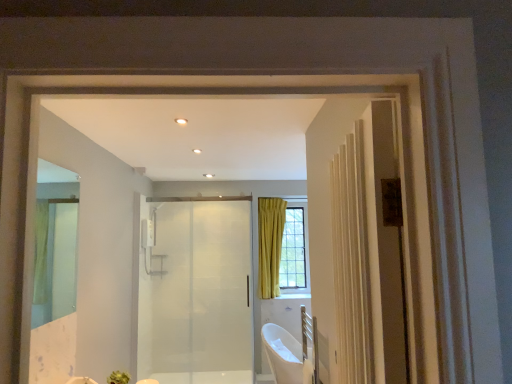
Question: Does clear glass mirror at left touch white glossy bathtub at lower center?

Choices:
 (A) yes
 (B) no

Answer: (B)

Question: Can you confirm if clear glass mirror at left is smaller than white glossy bathtub at lower center?

Choices:
 (A) no
 (B) yes

Answer: (B)

Question: Is clear glass mirror at left to the left of white glossy bathtub at lower center from the viewer's perspective?

Choices:
 (A) yes
 (B) no

Answer: (A)

Question: Is white glossy bathtub at lower center completely or partially inside clear glass mirror at left?

Choices:
 (A) no
 (B) yes

Answer: (A)

Question: From the image's perspective, is clear glass mirror at left above white glossy bathtub at lower center?

Choices:
 (A) yes
 (B) no

Answer: (A)

Question: Is transparent glass door at center inside the boundaries of white glossy bathtub at lower center, or outside?

Choices:
 (A) inside
 (B) outside

Answer: (B)

Question: From the image's perspective, is transparent glass door at center located above or below white glossy bathtub at lower center?

Choices:
 (A) above
 (B) below

Answer: (A)

Question: Considering the positions of transparent glass door at center and white glossy bathtub at lower center in the image, is transparent glass door at center taller or shorter than white glossy bathtub at lower center?

Choices:
 (A) short
 (B) tall

Answer: (B)

Question: In the image, is transparent glass door at center positioned in front of or behind white glossy bathtub at lower center?

Choices:
 (A) front
 (B) behind

Answer: (B)

Question: Is transparent glass door at center spatially inside clear glass mirror at left, or outside of it?

Choices:
 (A) inside
 (B) outside

Answer: (B)

Question: From the image's perspective, relative to clear glass mirror at left, is transparent glass door at center above or below?

Choices:
 (A) below
 (B) above

Answer: (A)

Question: Is transparent glass door at center wider or thinner than clear glass mirror at left?

Choices:
 (A) wide
 (B) thin

Answer: (A)

Question: Is point (200, 288) positioned closer to the camera than point (36, 218)?

Choices:
 (A) closer
 (B) farther

Answer: (B)

Question: Considering the positions of point (73, 291) and point (178, 311), is point (73, 291) closer or farther from the camera than point (178, 311)?

Choices:
 (A) farther
 (B) closer

Answer: (B)

Question: Considering their positions, is clear glass mirror at left located in front of or behind transparent glass door at center?

Choices:
 (A) behind
 (B) front

Answer: (B)